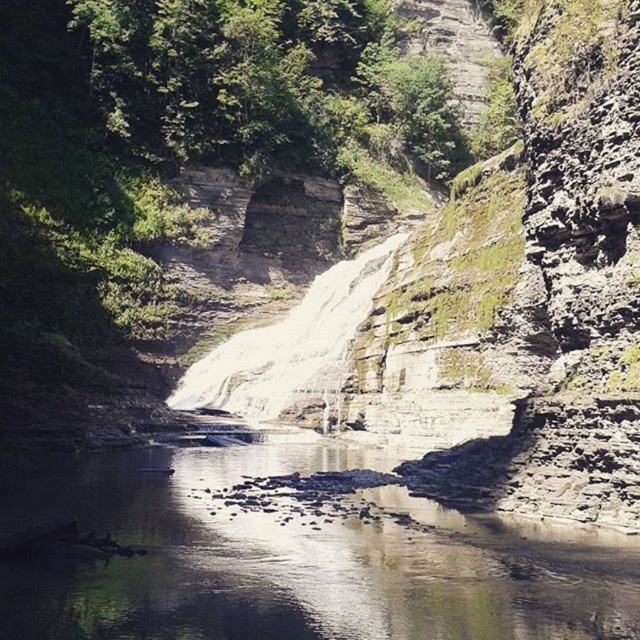
Between point (506, 611) and point (326, 385), which one is positioned behind?

The point (326, 385) is behind.

Locate an element on the screen. clear water at center is located at coordinates (292, 560).